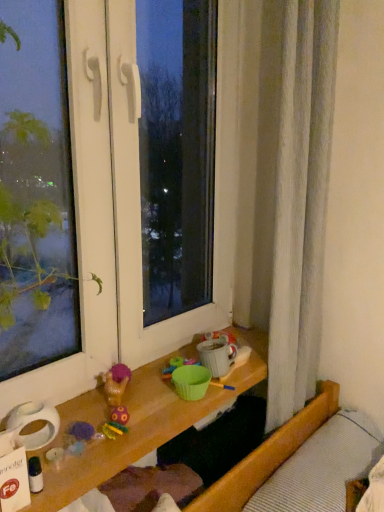
Locate an element on the screen. The height and width of the screenshot is (512, 384). vacant point above white textured bed at lower right (from a real-world perspective) is located at coordinates (345, 472).